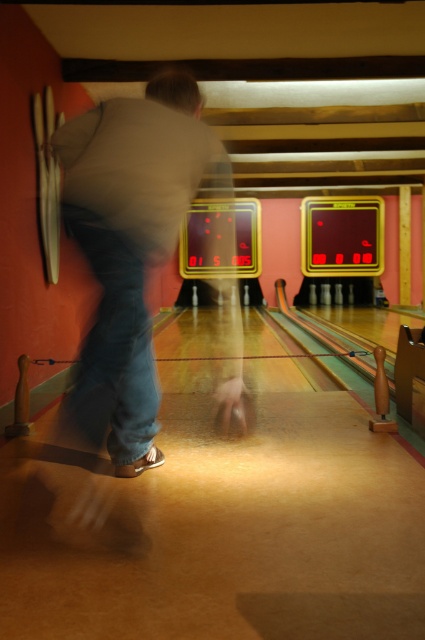
You are a photographer trying to capture the best shot of the person bowling. You notice the light brown casual clothing at center and the denim at center. Which clothing item should you focus on to ensure it is clearly visible in your photo?

The light brown casual clothing at center is larger in size than denim at center, so focusing on it will ensure better visibility.

From the picture: You are standing at the starting position on the bowling lane and want to aim for the center pin. There are two points marked on the lane at coordinates point (132, 413) and point (132, 248). Which point should you aim for to ensure your ball passes behind the other point and reaches the pins?

You should aim for point (132, 413) because it is behind point (132, 248), meaning the ball will pass over it last and reach the pins more effectively.

You are standing at the entrance of the bowling alley and see the point at coordinates (130, 246). What object is located at that point?

The light brown casual clothing at center is located at point (130, 246).